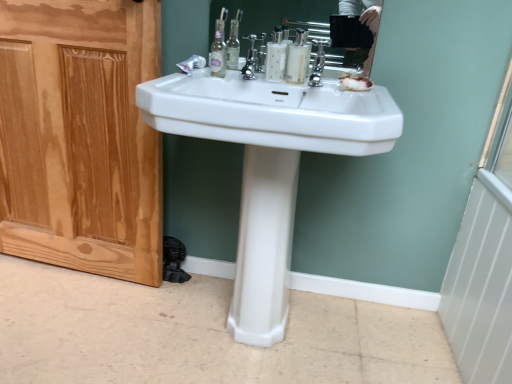
Identify the location of vacant space in between natural wood screen door at left and white glossy pedestal at center. (163, 303).